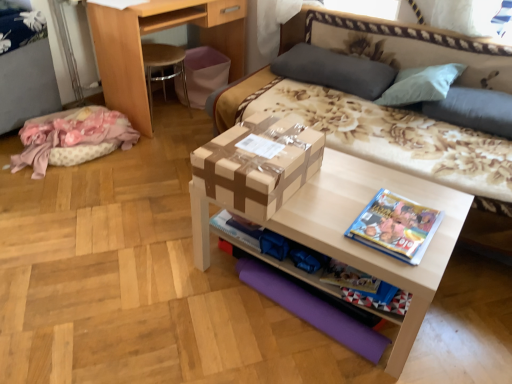
I want to click on gray fabric pillow at upper right, which is the 2th pillow from left to right, so click(473, 110).

What is the approximate width of gray fabric pillow at upper right, the first pillow from the right?

It is 12.83 inches.

What do you see at coordinates (257, 164) in the screenshot? The image size is (512, 384). I see `brown cardboard box at center` at bounding box center [257, 164].

At what (x,y) coordinates should I click in order to perform the action: click on gray fabric pillow at upper right, which is the 2th pillow from left to right. Please return your answer as a coordinate pair (x, y). Looking at the image, I should click on (473, 110).

You are a GUI agent. You are given a task and a screenshot of the screen. Output one action in this format:
    pyautogui.click(x=<x>, y=<y>)
    Task: Click on the chair directly beneath the brown cardboard box at center (from a real-world perspective)
    
    Given the screenshot: What is the action you would take?
    pyautogui.click(x=163, y=68)

Looking at this image, could you tell me if wooden at left is facing brown cardboard box at center?

No, wooden at left is not aimed at brown cardboard box at center.

Is the depth of wooden at left greater than that of brown cardboard box at center?

Yes, it is behind brown cardboard box at center.

From the image's perspective, is blue glossy book at right above or below matte cardboard box at center?

Clearly, from the image's perspective, blue glossy book at right is above matte cardboard box at center.

What's the angular difference between blue glossy book at right and matte cardboard box at center's facing directions?

The angular difference between blue glossy book at right and matte cardboard box at center is 0.209 degrees.

Which is in front, point (428, 209) or point (344, 205)?

Positioned in front is point (428, 209).

Identify the location of book above the matte cardboard box at center (from a real-world perspective). (396, 227).

Considering the positions of points (397, 335) and (261, 166), is point (397, 335) farther from camera compared to point (261, 166)?

Yes, it is behind point (261, 166).

Is matte cardboard box at center completely or partially outside of brown cardboard box at center?

Yes, matte cardboard box at center is not within brown cardboard box at center.

What's the angular difference between matte cardboard box at center and brown cardboard box at center's facing directions?

90 degrees.

Which object is more forward, blue glossy book at right or wooden at left?

A: blue glossy book at right is closer to the camera.

Looking at this image, can you confirm if blue glossy book at right is bigger than wooden at left?

Incorrect, blue glossy book at right is not larger than wooden at left.

Between point (417, 225) and point (154, 60), which one is positioned behind?

The point (154, 60) is farther.

What are the coordinates of `studio couch on the right of gray fabric pillow at upper center, which is the 1th pillow from left to right` in the screenshot? It's located at (406, 108).

Is gray fabric pillow at upper center, acting as the 2th pillow starting from the right, situated inside floral fabric studio couch at center or outside?

gray fabric pillow at upper center, acting as the 2th pillow starting from the right, exists entirely within floral fabric studio couch at center.

Could you tell me if gray fabric pillow at upper center, acting as the 2th pillow starting from the right, is facing floral fabric studio couch at center?

Yes.

Which is farther, (374, 70) or (460, 122)?

Positioned behind is point (374, 70).

From a real-world perspective, is floral fabric studio couch at center below gray fabric pillow at upper center, which is the 1th pillow from left to right?

Indeed, from a real-world perspective, floral fabric studio couch at center is positioned beneath gray fabric pillow at upper center, which is the 1th pillow from left to right.

Which is farther from the camera, (489, 103) or (384, 77)?

The point (384, 77) is more distant.

Can you confirm if floral fabric studio couch at center is wider than gray fabric pillow at upper center, acting as the 2th pillow starting from the right?

Correct, the width of floral fabric studio couch at center exceeds that of gray fabric pillow at upper center, acting as the 2th pillow starting from the right.

Is floral fabric studio couch at center facing towards gray fabric pillow at upper center, which is the 1th pillow from left to right?

Yes, floral fabric studio couch at center is facing gray fabric pillow at upper center, which is the 1th pillow from left to right.

Considering the sizes of objects gray fabric pillow at upper right, which is the 2th pillow from left to right, and gray fabric pillow at upper center, acting as the 2th pillow starting from the right, in the image provided, who is smaller, gray fabric pillow at upper right, which is the 2th pillow from left to right, or gray fabric pillow at upper center, acting as the 2th pillow starting from the right,?

With smaller size is gray fabric pillow at upper right, which is the 2th pillow from left to right.

Considering the positions of point (506, 94) and point (328, 79), is point (506, 94) closer or farther from the camera than point (328, 79)?

Point (506, 94) is positioned closer to the camera compared to point (328, 79).

Is gray fabric pillow at upper right, the first pillow from the right, touching gray fabric pillow at upper center, which is the 1th pillow from left to right?

gray fabric pillow at upper right, the first pillow from the right, is not next to gray fabric pillow at upper center, which is the 1th pillow from left to right, and they're not touching.

Locate an element on the screen. The width and height of the screenshot is (512, 384). box below the wooden at left (from the image's perspective) is located at coordinates (257, 164).

Identify the location of book on the right side of matte cardboard box at center. The height and width of the screenshot is (384, 512). click(x=396, y=227).

From the image, which object appears to be nearer to brown cardboard box at center, floral fabric studio couch at center or matte cardboard box at center?

matte cardboard box at center lies closer to brown cardboard box at center than the other object.

From the image, which object appears to be farther from brown cardboard box at center, pink fabric at left or matte cardboard box at center?

Based on the image, pink fabric at left appears to be further to brown cardboard box at center.

Which object lies further to the anchor point gray fabric pillow at upper right, which is the 2th pillow from left to right, blue glossy book at right or brown cardboard box at center?

brown cardboard box at center.

Looking at the image, which one is located closer to blue glossy book at right, wooden at left or gray fabric pillow at upper center, which is the 1th pillow from left to right?

gray fabric pillow at upper center, which is the 1th pillow from left to right.

When comparing their distances from wooden at left, does light brown wood desk at upper left or matte cardboard box at center seem closer?

light brown wood desk at upper left lies closer to wooden at left than the other object.

From the picture: When comparing their distances from light brown wood desk at upper left, does brown cardboard box at center or gray fabric pillow at upper center, which is the 1th pillow from left to right, seem further?

→ The object further to light brown wood desk at upper left is brown cardboard box at center.

When comparing their distances from light brown wood desk at upper left, does matte cardboard box at center or floral fabric studio couch at center seem closer?

floral fabric studio couch at center is closer to light brown wood desk at upper left.

Considering their positions, is brown cardboard box at center positioned closer to wooden at left than gray fabric pillow at upper right, which is the 2th pillow from left to right?

brown cardboard box at center lies closer to wooden at left than the other object.

At what (x,y) coordinates should I click in order to perform the action: click on pillow between light brown wood desk at upper left and floral fabric studio couch at center in the horizontal direction. Please return your answer as a coordinate pair (x, y). This screenshot has width=512, height=384. Looking at the image, I should click on (335, 71).

Identify the location of chair between pink fabric at left and gray fabric pillow at upper center, which is the 1th pillow from left to right, from left to right. This screenshot has height=384, width=512. (163, 68).

Image resolution: width=512 pixels, height=384 pixels. Identify the location of box located between blue glossy book at right and wooden at left in the depth direction. (257, 164).

This screenshot has height=384, width=512. Find the location of `book between matte cardboard box at center and gray fabric pillow at upper right, which is the 2th pillow from left to right, in the horizontal direction`. book between matte cardboard box at center and gray fabric pillow at upper right, which is the 2th pillow from left to right, in the horizontal direction is located at coordinates (396, 227).